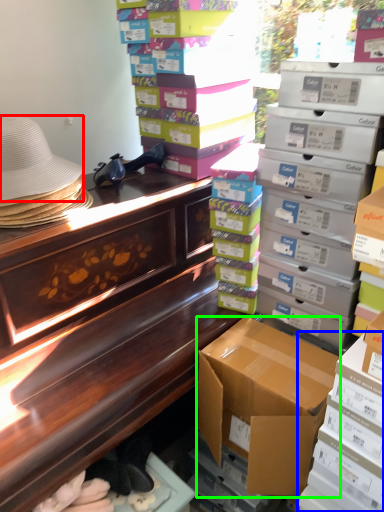
Question: Which is farther away from hat (highlighted by a red box)? box (highlighted by a blue box) or box (highlighted by a green box)?

Choices:
 (A) box
 (B) box

Answer: (A)